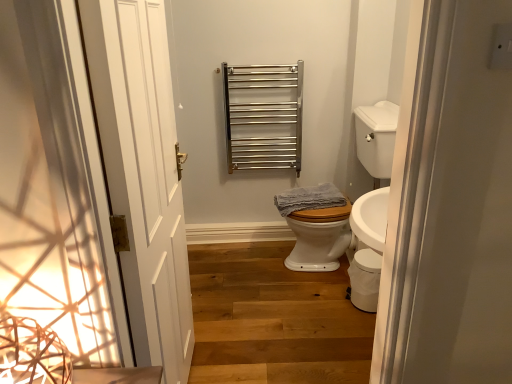
You are a GUI agent. You are given a task and a screenshot of the screen. Output one action in this format:
    pyautogui.click(x=<x>, y=<y>)
    Task: Click on the vacant space that's between white glossy sink at right and white glossy toilet bowl at lower right
    Image resolution: width=512 pixels, height=384 pixels.
    Given the screenshot: What is the action you would take?
    pyautogui.click(x=329, y=300)